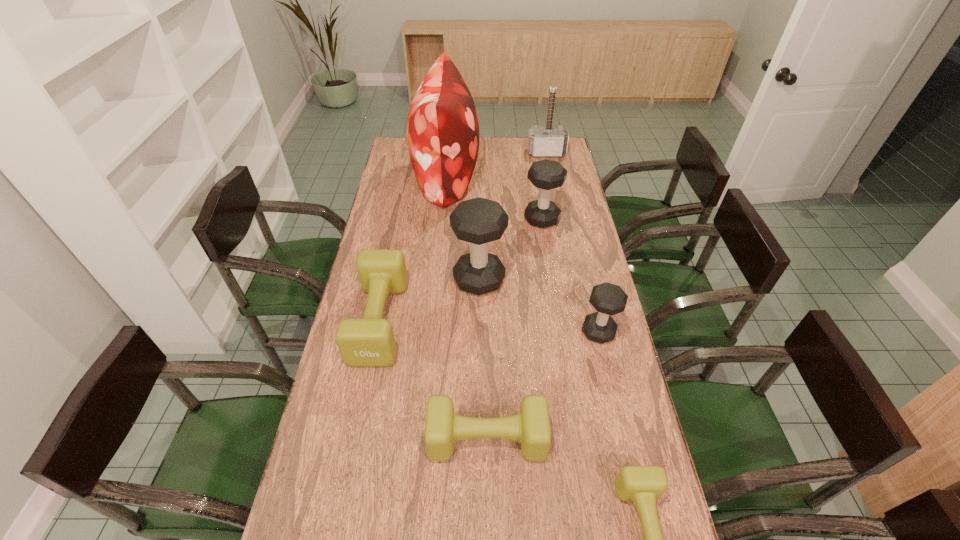
Where is `olive dumbbell that can be found as the third closest to the fourth tallest object`? The height and width of the screenshot is (540, 960). olive dumbbell that can be found as the third closest to the fourth tallest object is located at coordinates (643, 485).

What are the coordinates of `vacant space that satisfies the following two spatial constraints: 1. for striking with the head of the hammer; 2. on the front-facing side of the red cushion` in the screenshot? It's located at (551, 177).

Locate an element on the screen. The width and height of the screenshot is (960, 540). vacant area in the image that satisfies the following two spatial constraints: 1. on the back side of the second olive dumbbell from right to left; 2. on the front-facing side of the tallest object is located at coordinates (484, 177).